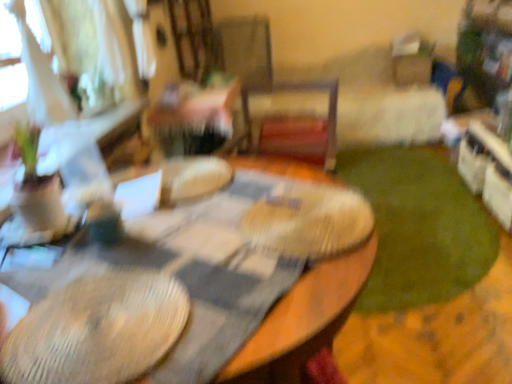
Question: Can you confirm if wooden table at center is bigger than green plush carpet at lower right?

Choices:
 (A) yes
 (B) no

Answer: (A)

Question: From the image's perspective, is wooden table at center below green plush carpet at lower right?

Choices:
 (A) yes
 (B) no

Answer: (A)

Question: Would you say green plush carpet at lower right is part of wooden table at center's contents?

Choices:
 (A) no
 (B) yes

Answer: (A)

Question: From a real-world perspective, is wooden table at center positioned under green plush carpet at lower right based on gravity?

Choices:
 (A) yes
 (B) no

Answer: (B)

Question: Does wooden table at center have a greater width compared to green plush carpet at lower right?

Choices:
 (A) yes
 (B) no

Answer: (B)

Question: Is wooden table at center next to green plush carpet at lower right and touching it?

Choices:
 (A) yes
 (B) no

Answer: (B)

Question: From a real-world perspective, is green plush carpet at lower right over wooden table at center?

Choices:
 (A) yes
 (B) no

Answer: (B)

Question: Does green plush carpet at lower right appear on the left side of wooden table at center?

Choices:
 (A) yes
 (B) no

Answer: (B)

Question: From the image's perspective, would you say green plush carpet at lower right is shown under wooden table at center?

Choices:
 (A) no
 (B) yes

Answer: (A)

Question: Considering the relative sizes of green plush carpet at lower right and wooden table at center in the image provided, is green plush carpet at lower right taller than wooden table at center?

Choices:
 (A) yes
 (B) no

Answer: (B)

Question: Is the position of green plush carpet at lower right more distant than that of wooden table at center?

Choices:
 (A) yes
 (B) no

Answer: (A)

Question: Considering the relative sizes of green plush carpet at lower right and wooden table at center in the image provided, is green plush carpet at lower right smaller than wooden table at center?

Choices:
 (A) yes
 (B) no

Answer: (A)

Question: From a real-world perspective, relative to green plush carpet at lower right, is wooden table at center vertically above or below?

Choices:
 (A) below
 (B) above

Answer: (B)